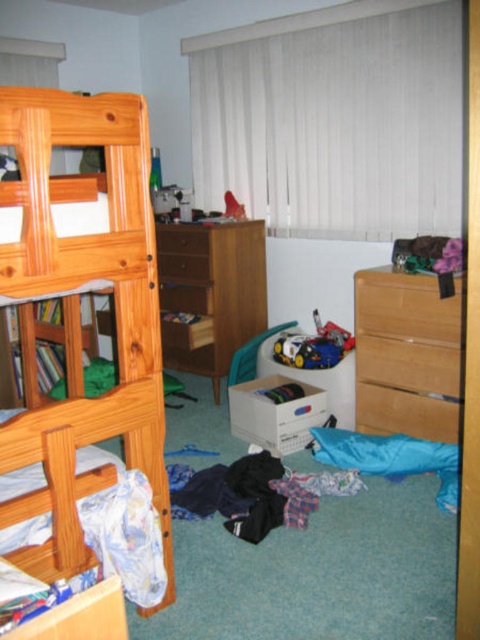
Question: Which point is closer to the camera?

Choices:
 (A) (211, 282)
 (B) (139, 403)

Answer: (B)

Question: Does light brown wooden dresser at right have a lesser width compared to wooden dresser at center?

Choices:
 (A) yes
 (B) no

Answer: (A)

Question: Among these points, which one is farthest from the camera?

Choices:
 (A) coord(457,426)
 (B) coord(132,188)
 (C) coord(212,342)

Answer: (C)

Question: Is natural wood bunk bed at left bigger than wooden dresser at center?

Choices:
 (A) yes
 (B) no

Answer: (B)

Question: Which of these objects is positioned farthest from the light brown wooden dresser at right?

Choices:
 (A) natural wood bunk bed at left
 (B) wooden dresser at center

Answer: (A)

Question: Is natural wood bunk bed at left smaller than light brown wooden dresser at right?

Choices:
 (A) yes
 (B) no

Answer: (B)